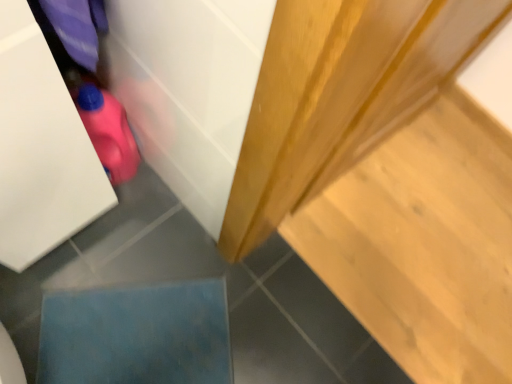
Question: Is blue fabric at lower left to the left or to the right of light wood stair at upper right in the image?

Choices:
 (A) right
 (B) left

Answer: (B)

Question: Is blue fabric at lower left spatially inside light wood stair at upper right, or outside of it?

Choices:
 (A) inside
 (B) outside

Answer: (B)

Question: Which is farther from the light wood stair at upper right?

Choices:
 (A) pink rubber toy at lower left
 (B) blue fabric at lower left

Answer: (A)

Question: Considering the real-world distances, which object is farthest from the blue fabric at lower left?

Choices:
 (A) pink rubber toy at lower left
 (B) light wood stair at upper right

Answer: (B)